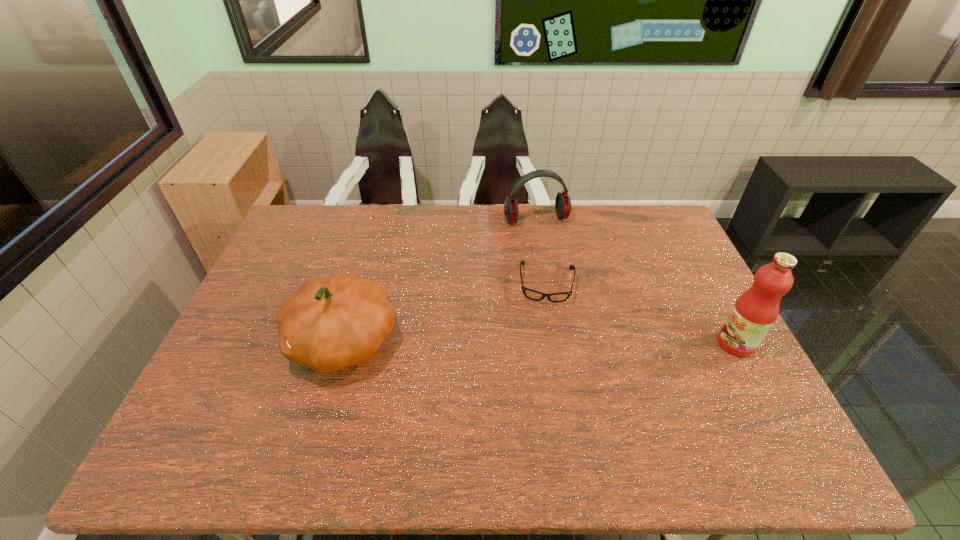
This screenshot has height=540, width=960. Identify the location of unoccupied area between the pumpkin and the farthest object. (440, 280).

Where is `free space that is in between the rightmost object and the spectacles`? This screenshot has width=960, height=540. free space that is in between the rightmost object and the spectacles is located at coordinates (641, 314).

Identify the location of free space between the fruit juice and the pumpkin. The height and width of the screenshot is (540, 960). (539, 342).

What are the coordinates of `vacant area that lies between the pumpkin and the earphone` in the screenshot? It's located at (440, 280).

Identify the location of vacant point located between the spectacles and the pumpkin. (444, 312).

I want to click on empty space between the earphone and the pumpkin, so click(440, 280).

Identify the location of free space that is in between the rightmost object and the earphone. This screenshot has width=960, height=540. (636, 282).

Locate an element on the screen. the third closest object to the shortest object is located at coordinates point(754,312).

Locate which object is the third closest to the third tallest object. Please provide its 2D coordinates. Your answer should be formatted as a tuple, i.e. [(x, y)], where the tuple contains the x and y coordinates of a point satisfying the conditions above.

[(754, 312)]

Locate an element on the screen. The image size is (960, 540). vacant space that satisfies the following two spatial constraints: 1. on the front side of the farthest object; 2. on the left side of the shortest object is located at coordinates (546, 284).